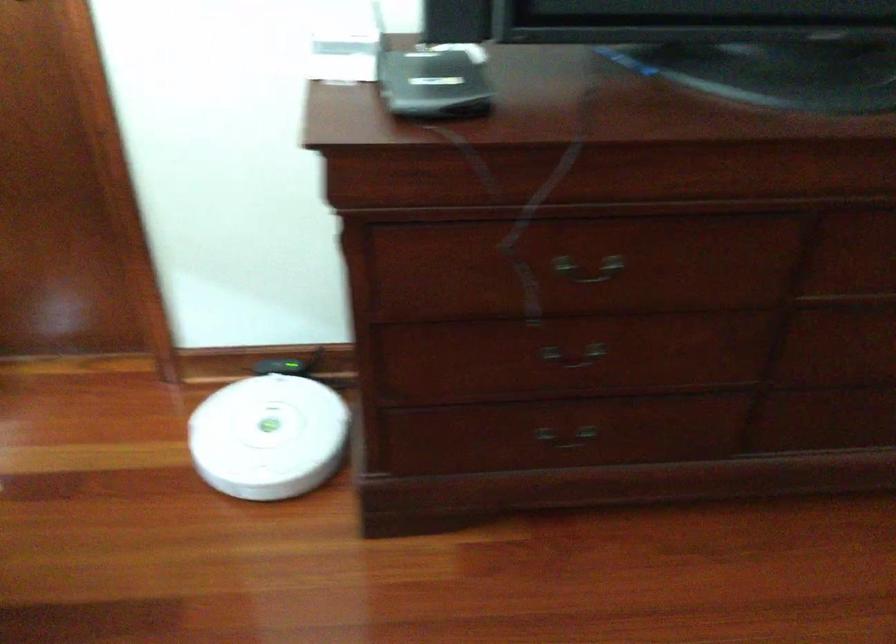
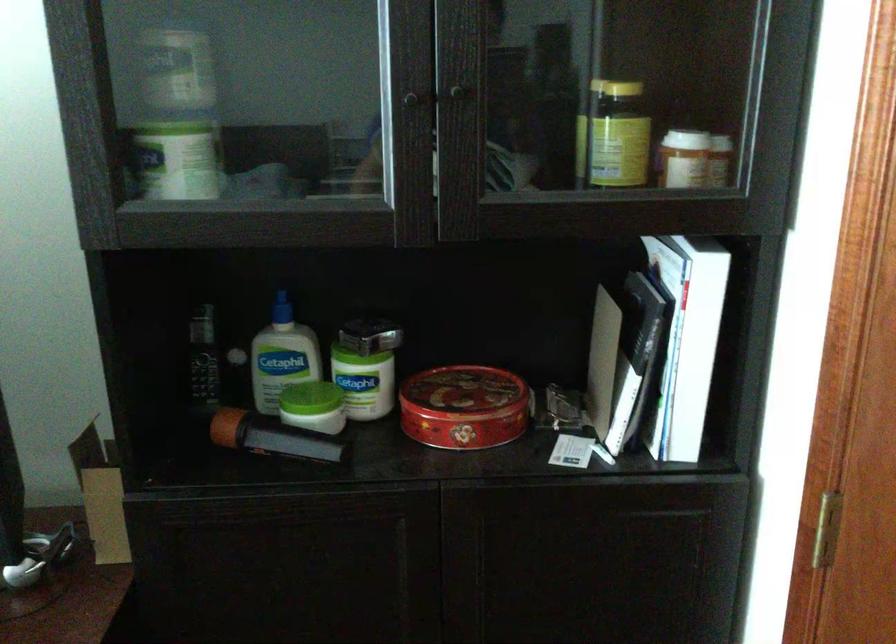
Question: In a continuous first-person perspective shot, in which direction is the camera moving?

Choices:
 (A) Left
 (B) Right
 (C) Forward
 (D) Backward

Answer: (B)